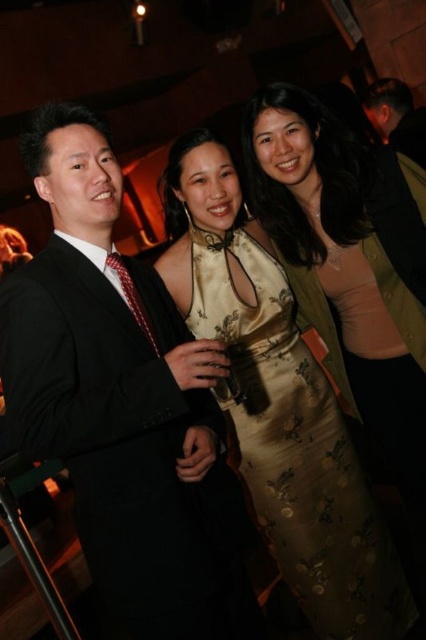
Question: Is black satin suit at left wider than black suit at upper right?

Choices:
 (A) yes
 (B) no

Answer: (A)

Question: Can you confirm if black satin suit at left is positioned to the left of silky gold dress at center?

Choices:
 (A) no
 (B) yes

Answer: (B)

Question: Which point is closer to the camera?

Choices:
 (A) black suit at upper right
 (B) silky gold dress at center
 (C) black satin suit at left

Answer: (C)

Question: Which of the following is the farthest from the observer?

Choices:
 (A) silky gold dress at center
 (B) black suit at upper right

Answer: (B)

Question: Which object is farther from the camera taking this photo?

Choices:
 (A) black satin suit at left
 (B) black suit at upper right

Answer: (B)

Question: Can you confirm if black satin suit at left is positioned to the right of silky gold dress at center?

Choices:
 (A) yes
 (B) no

Answer: (B)